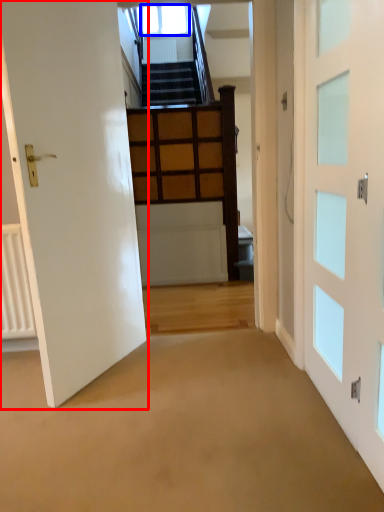
Question: Among these objects, which one is farthest to the camera, door (highlighted by a red box) or window (highlighted by a blue box)?

Choices:
 (A) door
 (B) window

Answer: (B)